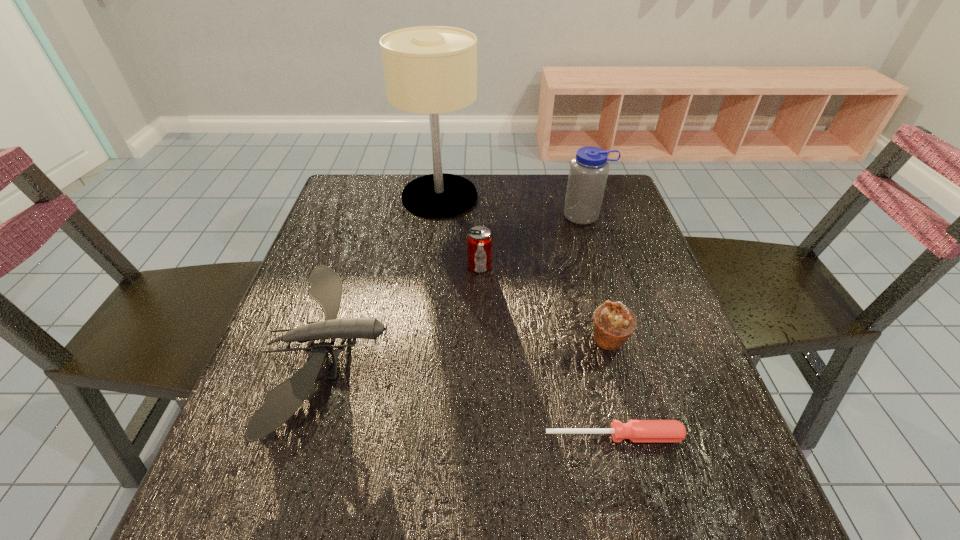
This screenshot has width=960, height=540. Find the location of `table lamp`. table lamp is located at coordinates (428, 69).

Locate an element on the screen. the second tallest object is located at coordinates (588, 173).

Find the location of a particular element. The height and width of the screenshot is (540, 960). muffin is located at coordinates (613, 324).

What are the coordinates of `the fourth nearest object` in the screenshot? It's located at (479, 239).

Identify the location of the fifth tallest object. (285, 399).

At what (x,y) coordinates should I click in order to perform the action: click on screwdriver. Please return your answer as a coordinate pair (x, y). The image size is (960, 540). Looking at the image, I should click on (635, 430).

Where is `vacant region located on the right of the table lamp`? This screenshot has height=540, width=960. vacant region located on the right of the table lamp is located at coordinates (575, 197).

The height and width of the screenshot is (540, 960). What are the coordinates of `vacant space located 0.310m with a carrying loop on the side of the fifth shortest object` in the screenshot? It's located at (613, 310).

Find the location of a particular element. The image size is (960, 540). vacant area situated 0.160m on the back of the muffin is located at coordinates (591, 274).

The width and height of the screenshot is (960, 540). I want to click on free space located on the right of the pop soda, so click(598, 266).